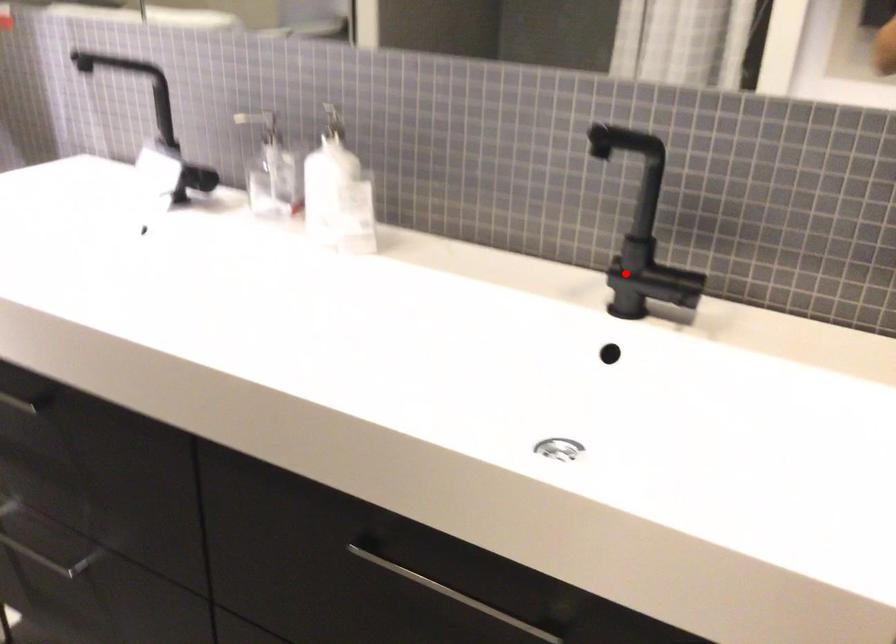
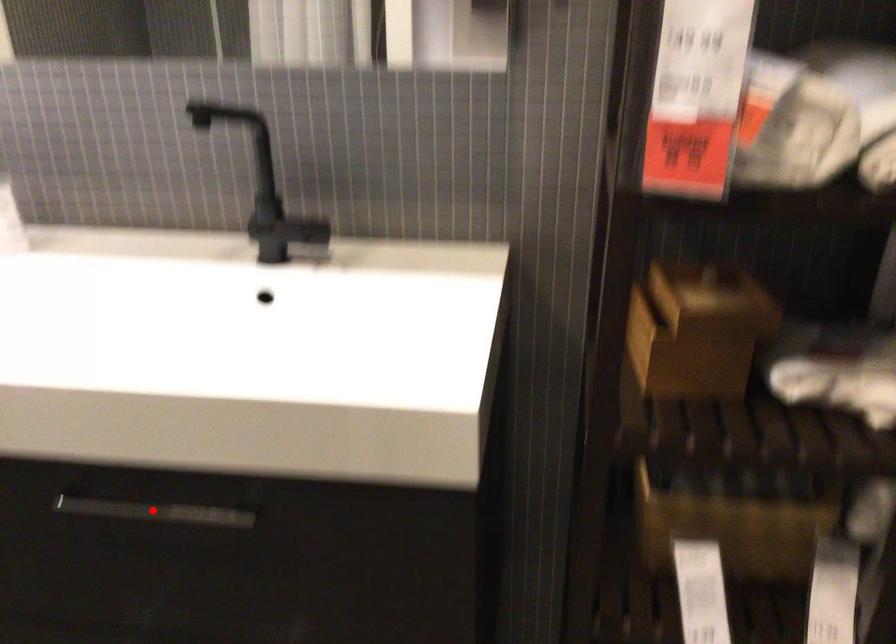
I am providing you with two images of the same scene from different viewpoints. A red point is marked on the first image and another point is marked on the second image. Are the points marked in image1 and image2 representing the same 3D position?

No